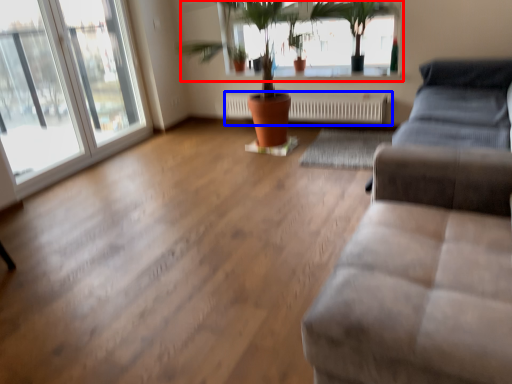
Question: Which point is further to the camera, bay window (highlighted by a red box) or radiator (highlighted by a blue box)?

Choices:
 (A) bay window
 (B) radiator

Answer: (B)